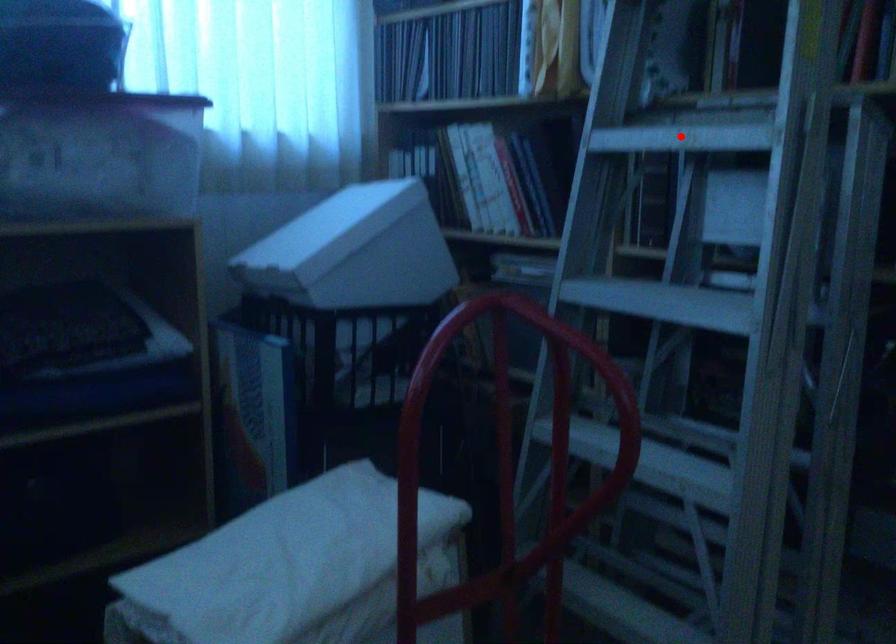
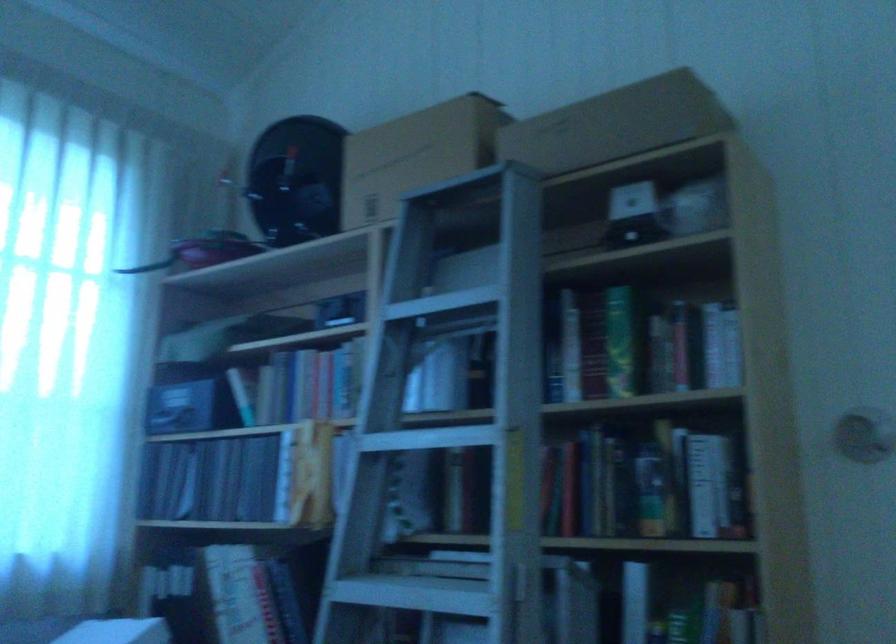
In the second image, find the point that corresponds to the highlighted location in the first image.

(415, 592)